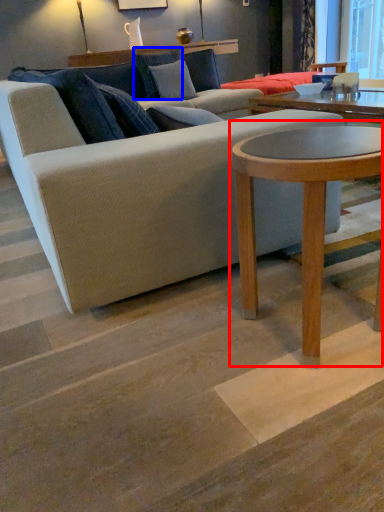
Question: Which object appears closest to the camera in this image, coffee table (highlighted by a red box) or pillow (highlighted by a blue box)?

Choices:
 (A) coffee table
 (B) pillow

Answer: (A)